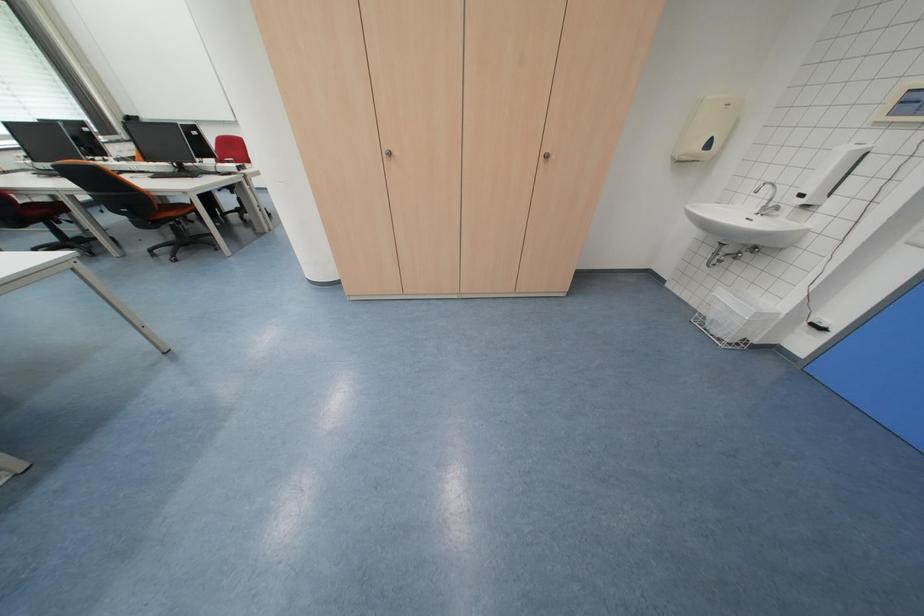
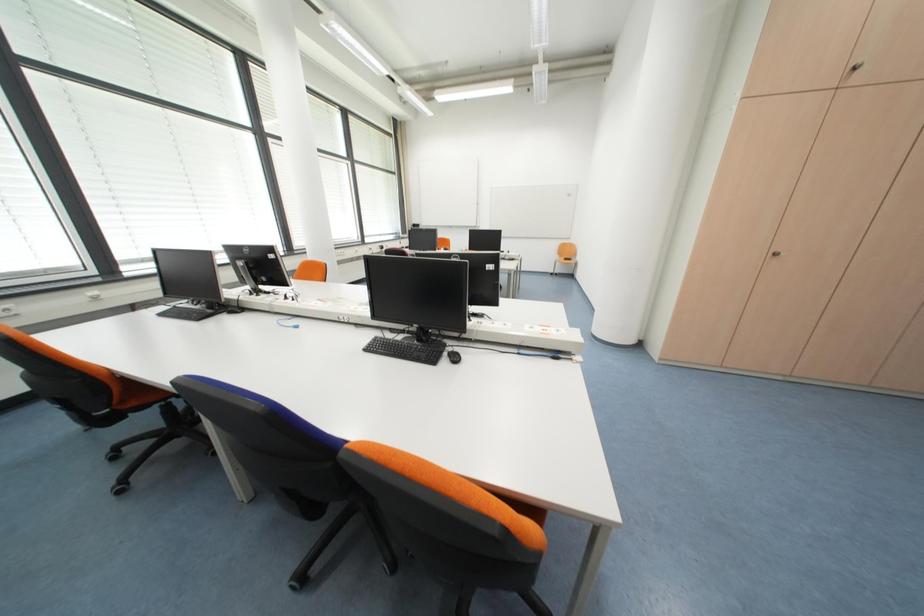
What movement of the cameraman would produce the second image?

The movement direction of the cameraman is left, backward.